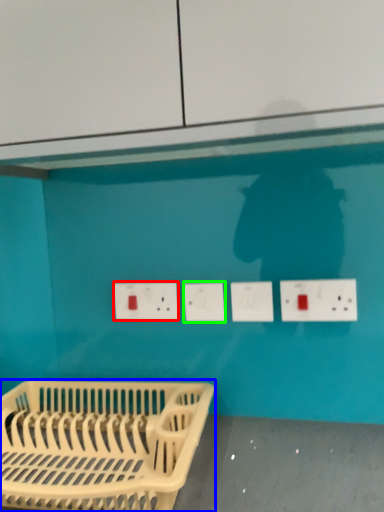
Question: Which object is positioned closest to electric outlet (highlighted by a red box)? Select from furniture (highlighted by a blue box) and socket (highlighted by a green box).

Choices:
 (A) furniture
 (B) socket

Answer: (B)